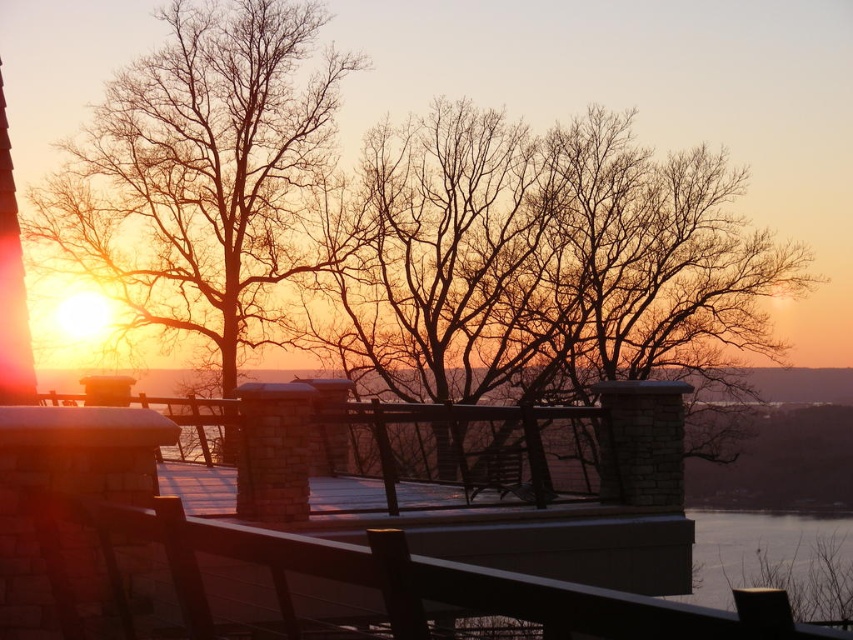
Question: Does bare branches at left have a larger size compared to transparent glass water at lower right?

Choices:
 (A) yes
 (B) no

Answer: (A)

Question: Is brown wood balcony at center to the right of bare branches at left from the viewer's perspective?

Choices:
 (A) yes
 (B) no

Answer: (A)

Question: Among these points, which one is nearest to the camera?

Choices:
 (A) (799, 611)
 (B) (195, 161)
 (C) (306, 426)

Answer: (C)

Question: Which object is farther from the camera taking this photo?

Choices:
 (A) brown wood balcony at center
 (B) bare branches at left
 (C) transparent glass water at lower right

Answer: (B)

Question: Does brown wood balcony at center appear on the right side of transparent glass water at lower right?

Choices:
 (A) no
 (B) yes

Answer: (A)

Question: Which object appears farthest from the camera in this image?

Choices:
 (A) transparent glass water at lower right
 (B) bare branches at left
 (C) brown wood balcony at center

Answer: (B)